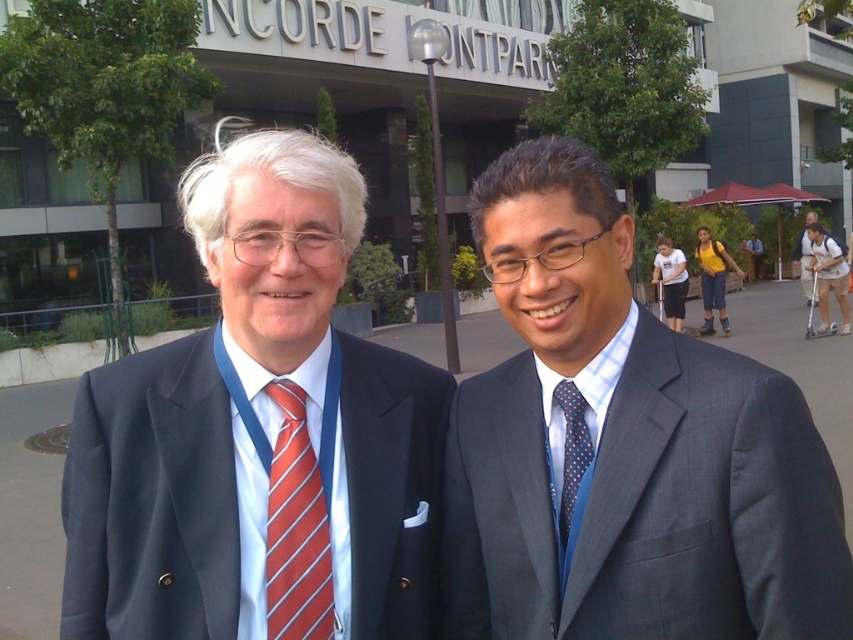
Question: Which point is closer to the camera taking this photo?

Choices:
 (A) (276, 445)
 (B) (375, 632)
 (C) (633, 438)

Answer: (C)

Question: Does gray pinstripe suit at center appear under white cotton shirt at right?

Choices:
 (A) no
 (B) yes

Answer: (B)

Question: Does gray pinstripe suit at center appear over white cotton shirt at right?

Choices:
 (A) yes
 (B) no

Answer: (B)

Question: Is gray pinstripe suit at center wider than blue dotted tie at center?

Choices:
 (A) no
 (B) yes

Answer: (B)

Question: Which of these objects is positioned farthest from the white cotton shirt at right?

Choices:
 (A) blue dotted tie at center
 (B) red striped tie at center

Answer: (A)

Question: Which point is farther to the camera?

Choices:
 (A) (314, 609)
 (B) (646, 556)

Answer: (A)